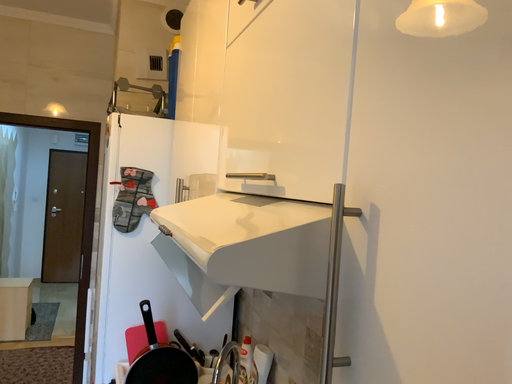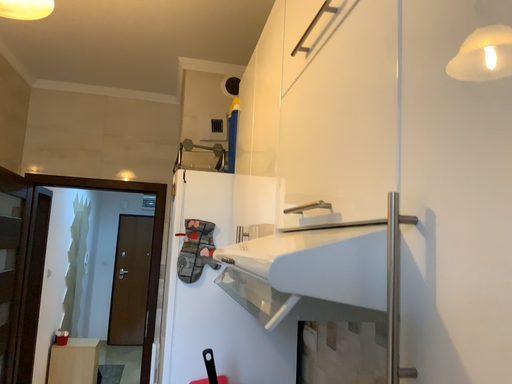
Question: How did the camera likely rotate when shooting the video?

Choices:
 (A) rotated upward
 (B) rotated downward

Answer: (A)